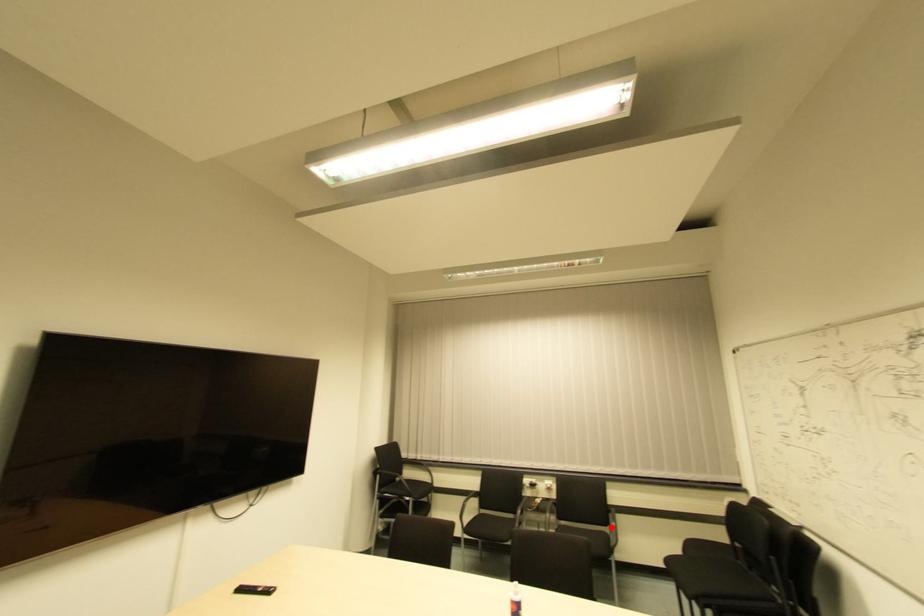
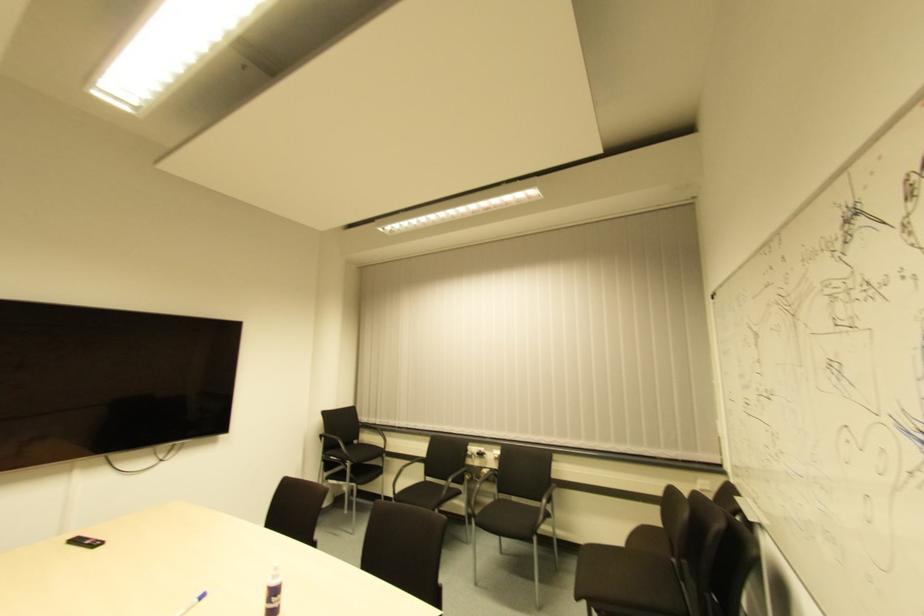
The point at the highlighted location is marked in the first image. Where is the corresponding point in the second image?

(542, 505)